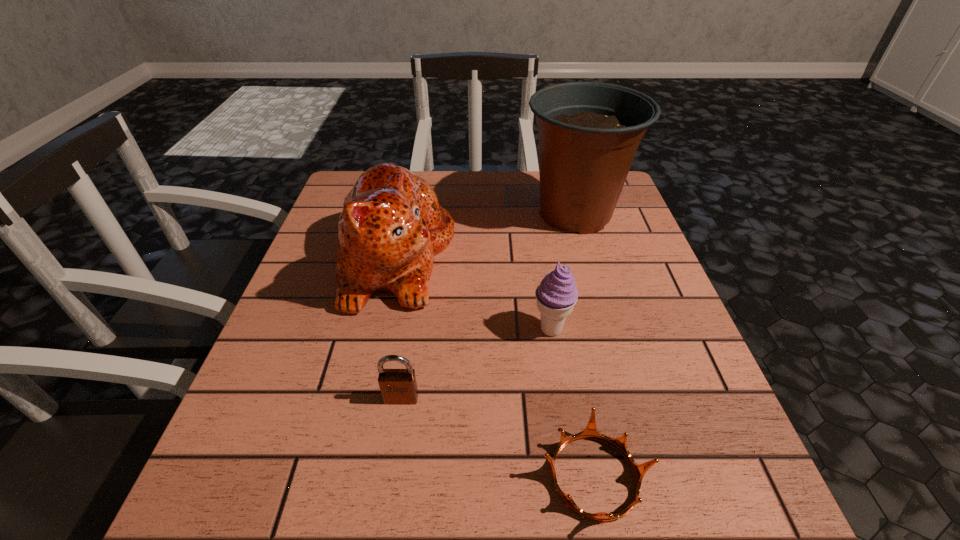
The height and width of the screenshot is (540, 960). In order to click on vacant point located between the fourth tallest object and the second tallest object in this screenshot , I will do `click(398, 328)`.

The image size is (960, 540). I want to click on empty location between the padlock and the cat, so click(x=398, y=328).

You are a GUI agent. You are given a task and a screenshot of the screen. Output one action in this format:
    pyautogui.click(x=<x>, y=<y>)
    Task: Click on the free space between the cat and the fourth tallest object
    
    Given the screenshot: What is the action you would take?
    pyautogui.click(x=398, y=328)

Where is `empty location between the nearest object and the flowerpot`? empty location between the nearest object and the flowerpot is located at coordinates (585, 346).

Where is `vacant space that is in between the icecream and the nearest object`? The width and height of the screenshot is (960, 540). vacant space that is in between the icecream and the nearest object is located at coordinates (573, 403).

Select which object is the second closest to the shortest object. Please provide its 2D coordinates. Your answer should be formatted as a tuple, i.e. [(x, y)], where the tuple contains the x and y coordinates of a point satisfying the conditions above.

[(398, 386)]

Identify the location of object that is the second closest to the cat. (589, 132).

Image resolution: width=960 pixels, height=540 pixels. I want to click on vacant space that satisfies the following two spatial constraints: 1. on the back side of the nearest object; 2. on the face of the cat, so click(552, 257).

Find the location of `vacant space that satisfies the following two spatial constraints: 1. on the front side of the flowerpot; 2. on the face of the cat`. vacant space that satisfies the following two spatial constraints: 1. on the front side of the flowerpot; 2. on the face of the cat is located at coordinates (588, 257).

Identify the location of vacant space that satisfies the following two spatial constraints: 1. on the front-facing side of the nearest object; 2. on the left side of the fourth tallest object. The height and width of the screenshot is (540, 960). (389, 477).